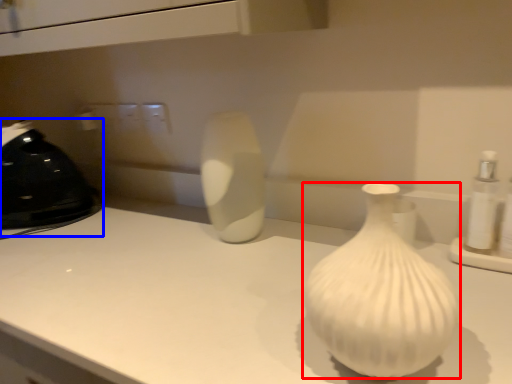
Question: Which object is further to the camera taking this photo, vase (highlighted by a red box) or appliance (highlighted by a blue box)?

Choices:
 (A) vase
 (B) appliance

Answer: (B)